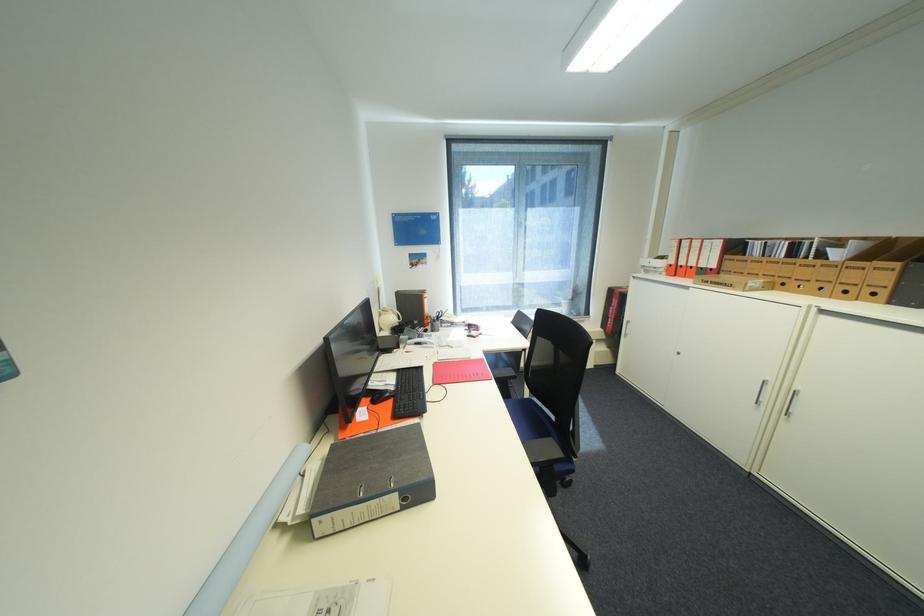
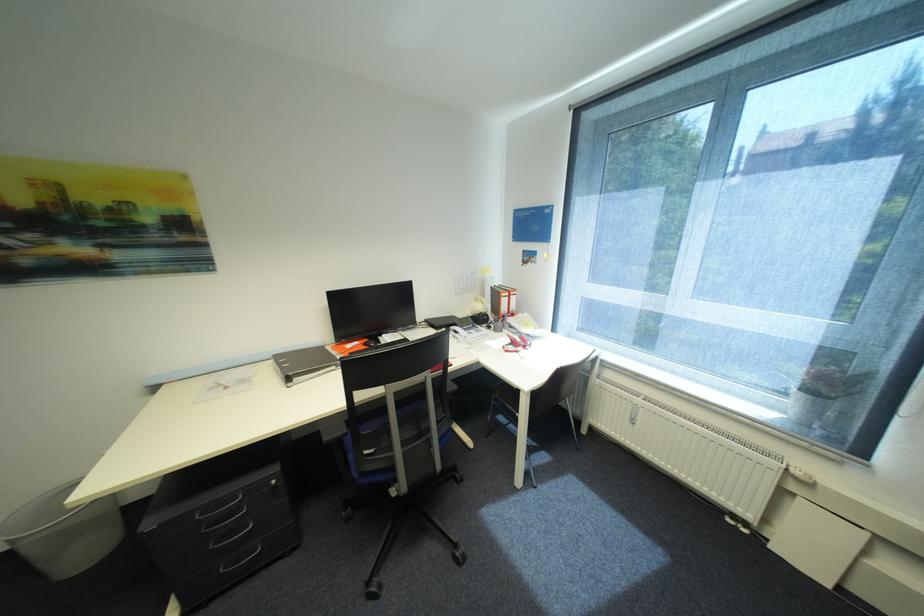
Locate, in the second image, the point that corresponds to (428,265) in the first image.

(537, 265)